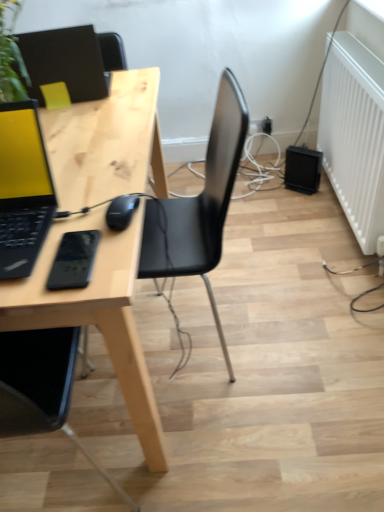
Where is `blank area to the left of black plastic speaker at lower right`? The image size is (384, 512). blank area to the left of black plastic speaker at lower right is located at coordinates (277, 193).